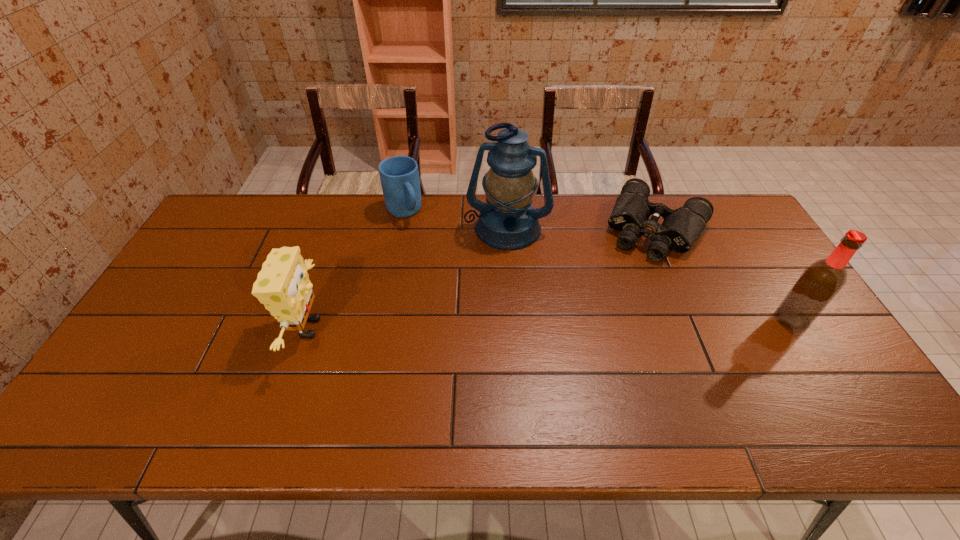
The width and height of the screenshot is (960, 540). What are the coordinates of `vacant area located 0.300m on the face of the sponge` in the screenshot? It's located at (442, 328).

Identify the location of vacant space situated 0.070m on the left of the beer bottle. The height and width of the screenshot is (540, 960). (751, 319).

You are a GUI agent. You are given a task and a screenshot of the screen. Output one action in this format:
    pyautogui.click(x=<x>, y=<y>)
    Task: Click on the vacant space located on the face of the tallest object
    This screenshot has height=540, width=960.
    Given the screenshot: What is the action you would take?
    pyautogui.click(x=489, y=292)

The width and height of the screenshot is (960, 540). In order to click on free region located on the face of the tallest object in this screenshot , I will do `click(487, 299)`.

This screenshot has width=960, height=540. In order to click on vacant region located on the face of the tallest object in this screenshot , I will do `click(495, 266)`.

Locate an element on the screen. The image size is (960, 540). free space located 0.100m on the side of the fourth object from right to left with the handle is located at coordinates (422, 243).

The height and width of the screenshot is (540, 960). I want to click on vacant space located on the side of the fourth object from right to left with the handle, so click(x=424, y=247).

You are a GUI agent. You are given a task and a screenshot of the screen. Output one action in this format:
    pyautogui.click(x=<x>, y=<y>)
    Task: Click on the free spot located 0.200m on the side of the fourth object from right to left with the handle
    Image resolution: width=960 pixels, height=540 pixels.
    Given the screenshot: What is the action you would take?
    pyautogui.click(x=435, y=262)

Find the location of a particular element. blank space located through the eyepieces of the shortest object is located at coordinates (620, 303).

Image resolution: width=960 pixels, height=540 pixels. Identify the location of blank area located 0.060m through the eyepieces of the shortest object. (636, 271).